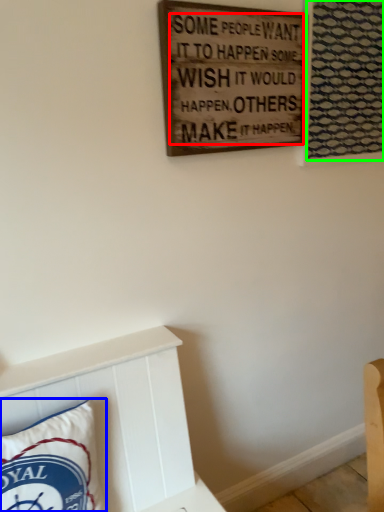
Question: Based on their relative distances, which object is nearer to writing (highlighted by a red box)? Choose from pillow (highlighted by a blue box) and tapestry (highlighted by a green box).

Choices:
 (A) pillow
 (B) tapestry

Answer: (B)